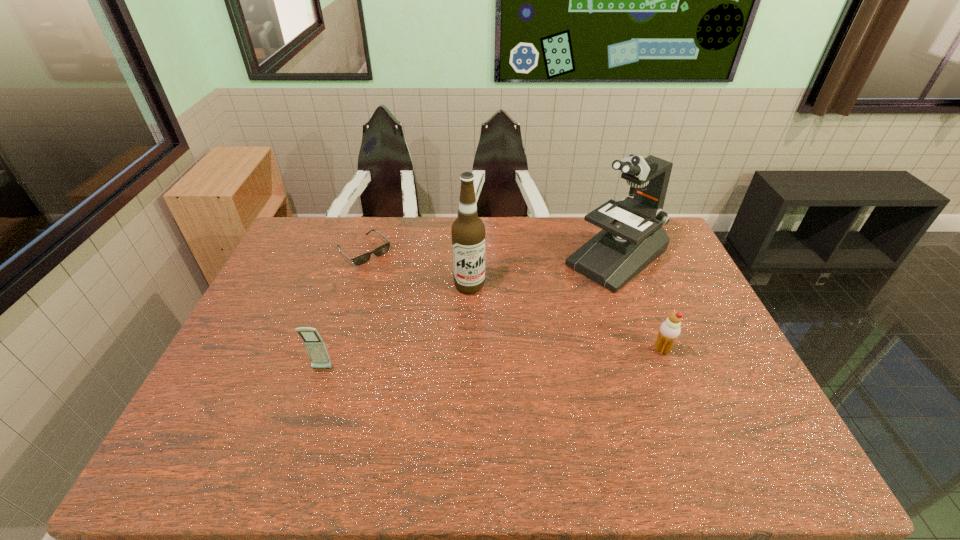
Find the location of a particular element. This screenshot has width=960, height=540. vacant area that lies between the cellular telephone and the second nearest object is located at coordinates 492,359.

The width and height of the screenshot is (960, 540). Find the location of `empty space that is in between the alcohol and the shortest object`. empty space that is in between the alcohol and the shortest object is located at coordinates [x=417, y=268].

Locate an element on the screen. The image size is (960, 540). vacant space that's between the shortest object and the fourth farthest object is located at coordinates (514, 301).

You are a GUI agent. You are given a task and a screenshot of the screen. Output one action in this format:
    pyautogui.click(x=<x>, y=<y>)
    Task: Click on the empty space between the second nearest object and the microscope
    The height and width of the screenshot is (540, 960).
    Given the screenshot: What is the action you would take?
    pyautogui.click(x=639, y=304)

This screenshot has width=960, height=540. Find the location of `unoccupied area between the cellular telephone and the alcohol`. unoccupied area between the cellular telephone and the alcohol is located at coordinates (396, 327).

I want to click on vacant space in between the fourth farthest object and the sunglasses, so click(x=514, y=301).

Image resolution: width=960 pixels, height=540 pixels. I want to click on object that stands as the second closest to the alcohol, so click(x=632, y=237).

This screenshot has height=540, width=960. Identify the location of the third closest object relative to the microscope. (382, 249).

Locate an element on the screen. free space that satisfies the following two spatial constraints: 1. on the front side of the microscope; 2. on the left side of the shortest object is located at coordinates (362, 258).